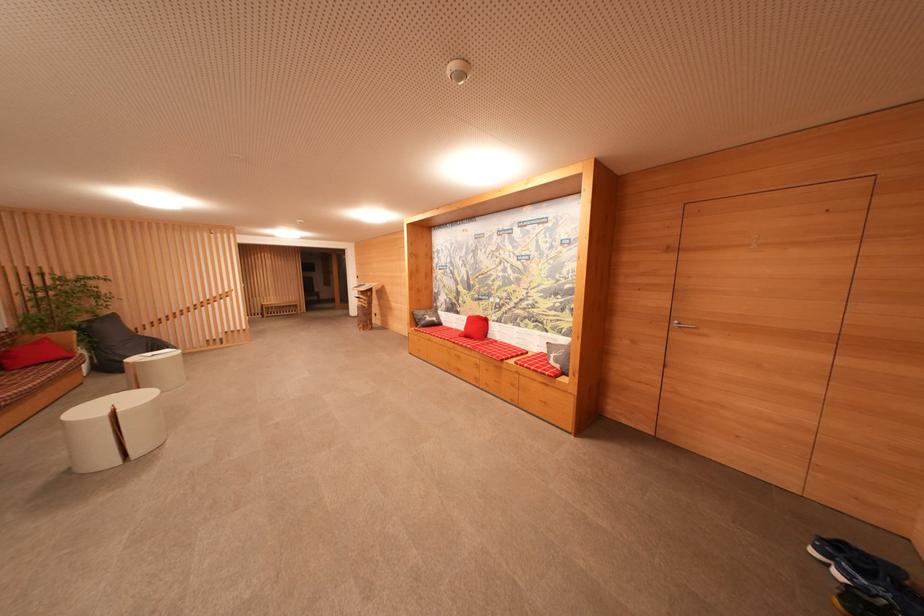
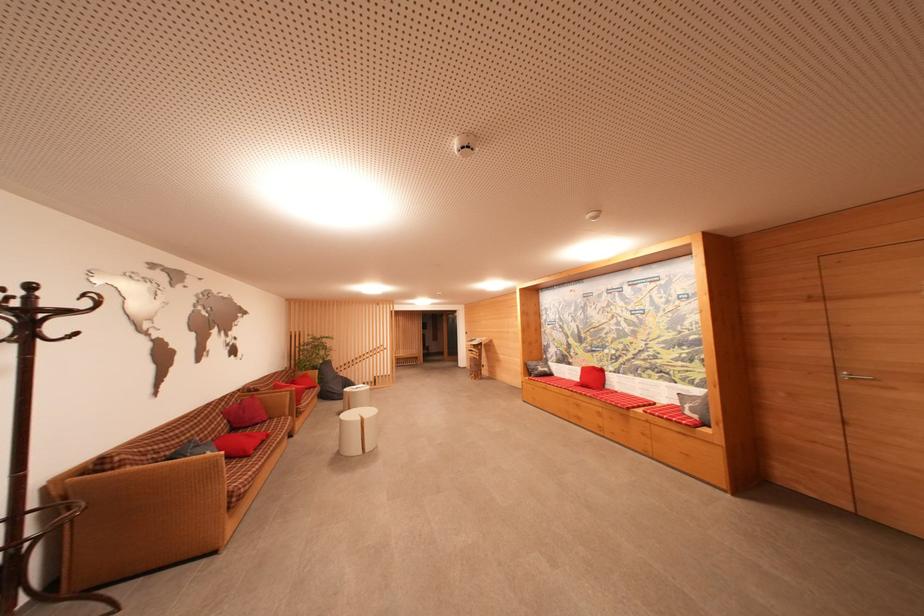
Locate, in the second image, the point that corresponds to (90,321) in the first image.

(323, 365)